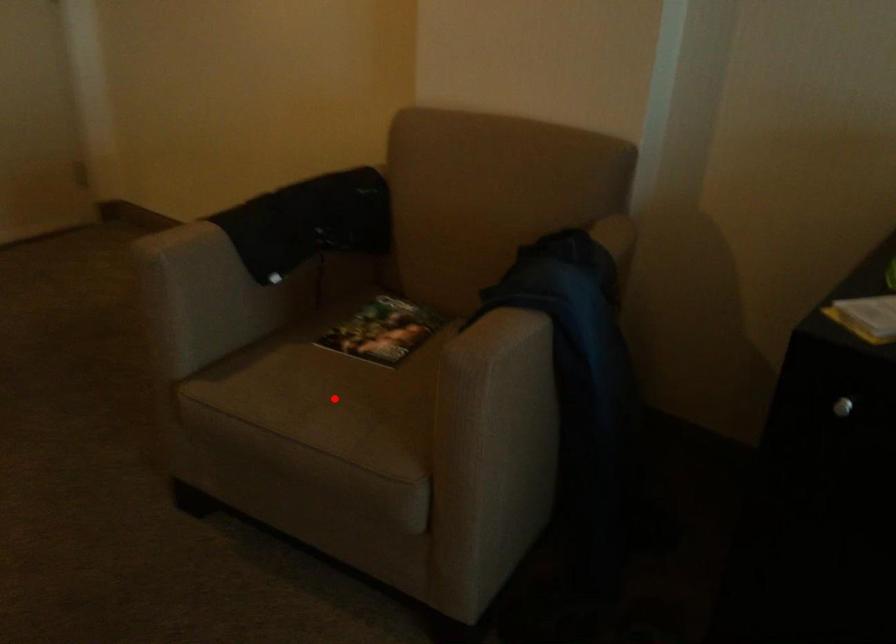
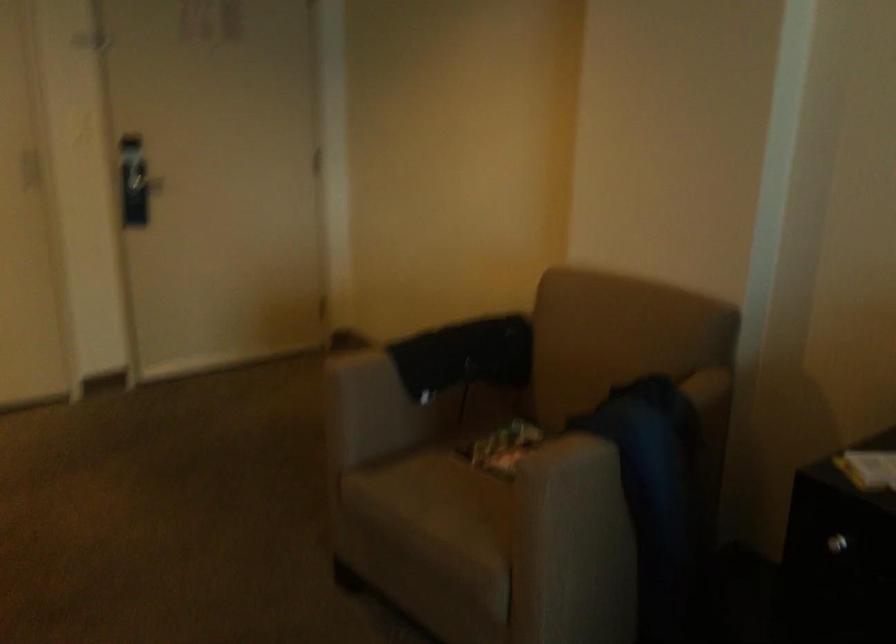
The point at the highlighted location is marked in the first image. Where is the corresponding point in the second image?

(453, 500)